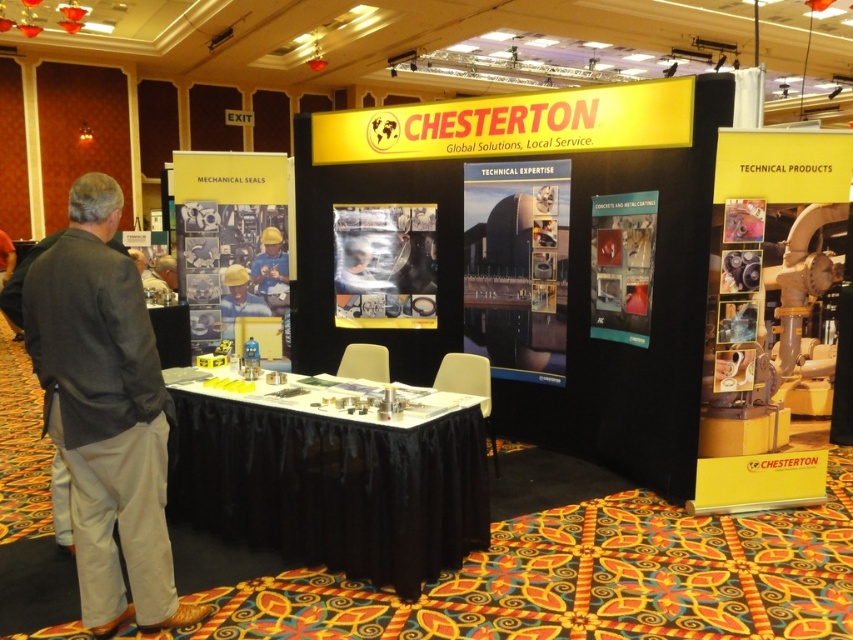
Between white fabric table at center and gray fabric pants at left, which one is positioned lower?

white fabric table at center is lower down.

Is white fabric table at center further to the viewer compared to gray fabric pants at left?

Yes, it is behind gray fabric pants at left.

This screenshot has height=640, width=853. What are the coordinates of `white fabric table at center` in the screenshot? It's located at (332, 486).

Locate an element on the screen. Image resolution: width=853 pixels, height=640 pixels. white fabric table at center is located at coordinates tap(332, 486).

Consider the image. Is gray fabric pants at left taller than yellow hard hat at center?

Yes, gray fabric pants at left is taller than yellow hard hat at center.

Who is more distant from viewer, (73,198) or (244,314)?

Point (244,314)

Is point (173, 616) in front of point (235, 312)?

Yes.

I want to click on gray fabric pants at left, so tap(105, 412).

Who is shorter, white fabric table at center or yellow hard hat at center?

yellow hard hat at center

Who is positioned more to the left, white fabric table at center or yellow hard hat at center?

yellow hard hat at center is more to the left.

The height and width of the screenshot is (640, 853). Describe the element at coordinates (332, 486) in the screenshot. I see `white fabric table at center` at that location.

Where is `white fabric table at center`? Image resolution: width=853 pixels, height=640 pixels. white fabric table at center is located at coordinates (332, 486).